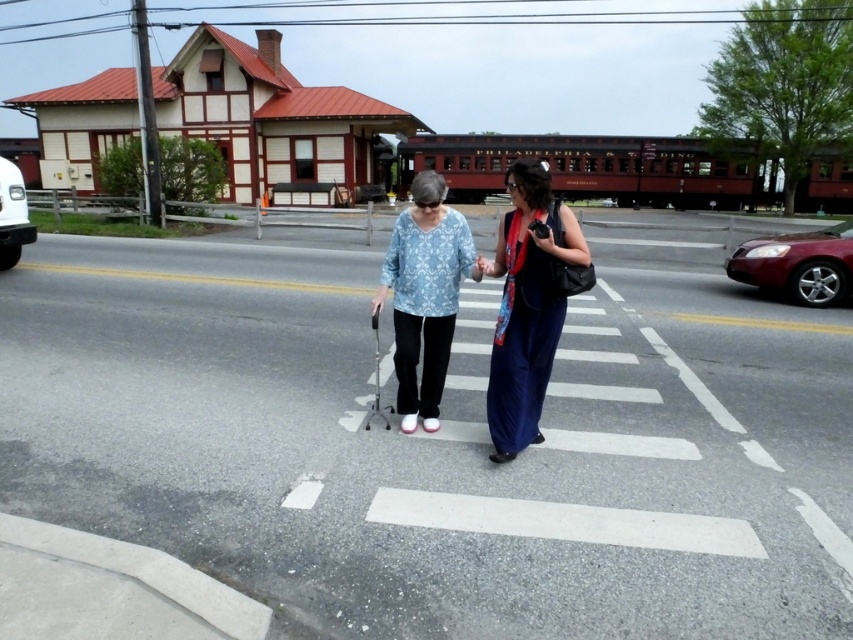
Question: Which object is the closest to the blue silk dress at center?

Choices:
 (A) shiny red sedan at right
 (B) white glossy van at left
 (C) light blue printed blouse at center

Answer: (C)

Question: Is light blue printed blouse at center to the right of shiny red sedan at right from the viewer's perspective?

Choices:
 (A) yes
 (B) no

Answer: (B)

Question: Which of the following is the farthest from the observer?

Choices:
 (A) (432, 224)
 (B) (521, 404)

Answer: (A)

Question: Among these objects, which one is farthest from the camera?

Choices:
 (A) light blue printed blouse at center
 (B) blue silk dress at center
 (C) white glossy van at left
 (D) shiny red sedan at right

Answer: (C)

Question: Where is blue silk dress at center located in relation to light blue printed blouse at center in the image?

Choices:
 (A) below
 (B) above

Answer: (B)

Question: Is light blue printed blouse at center to the right of shiny red sedan at right from the viewer's perspective?

Choices:
 (A) yes
 (B) no

Answer: (B)